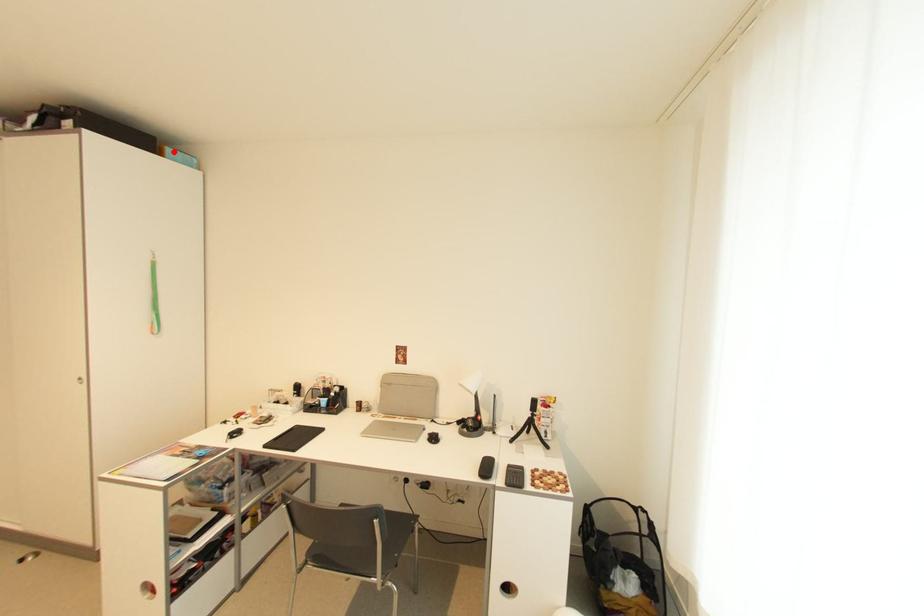
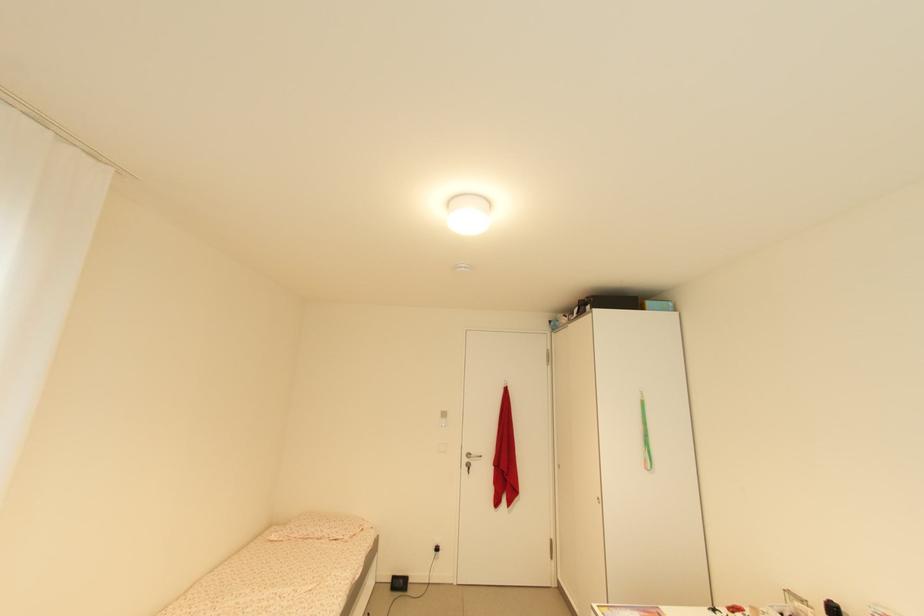
Locate, in the second image, the point that corresponds to the highlighted location in the first image.

(652, 304)